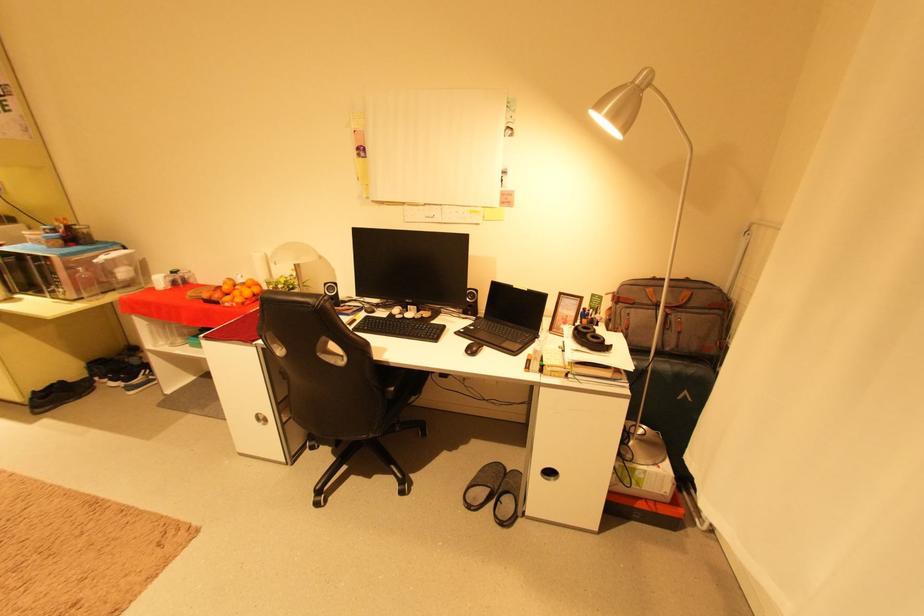
Find the location of a particular element. The width and height of the screenshot is (924, 616). clear plastic container is located at coordinates (59, 270).